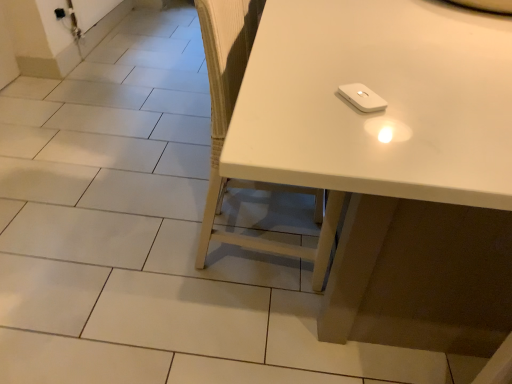
In order to click on vacant area that lies to the right of white matte wii controller at upper center in this screenshot , I will do `click(441, 110)`.